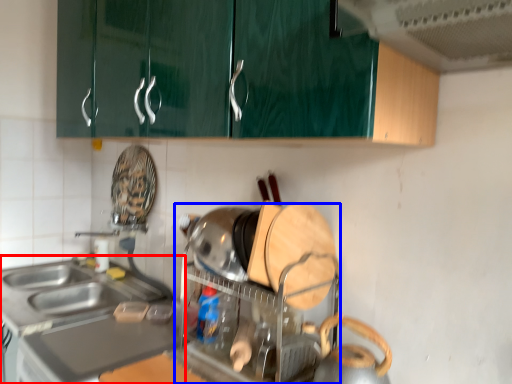
Question: Which point is closer to the camera, countertop (highlighted by a red box) or appliance (highlighted by a blue box)?

Choices:
 (A) countertop
 (B) appliance

Answer: (B)